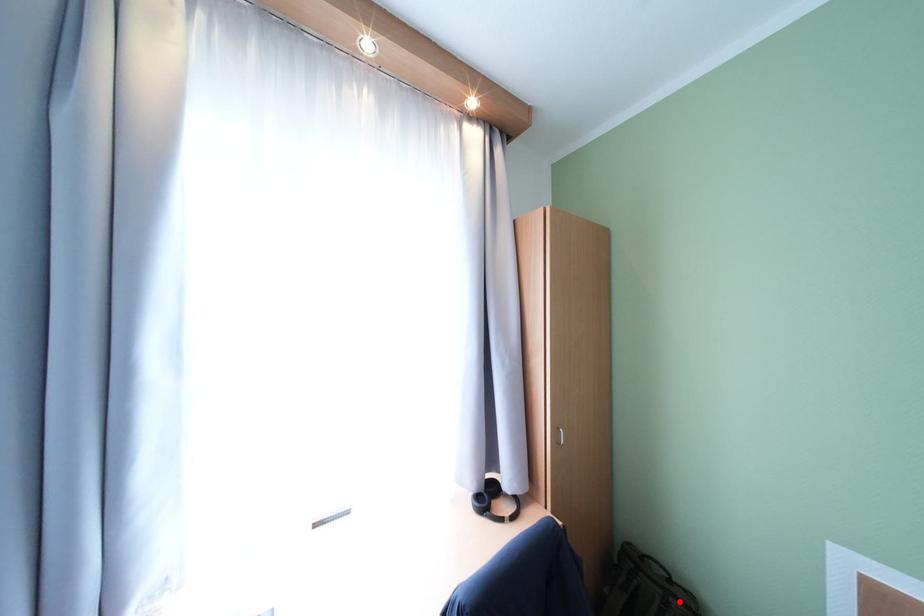
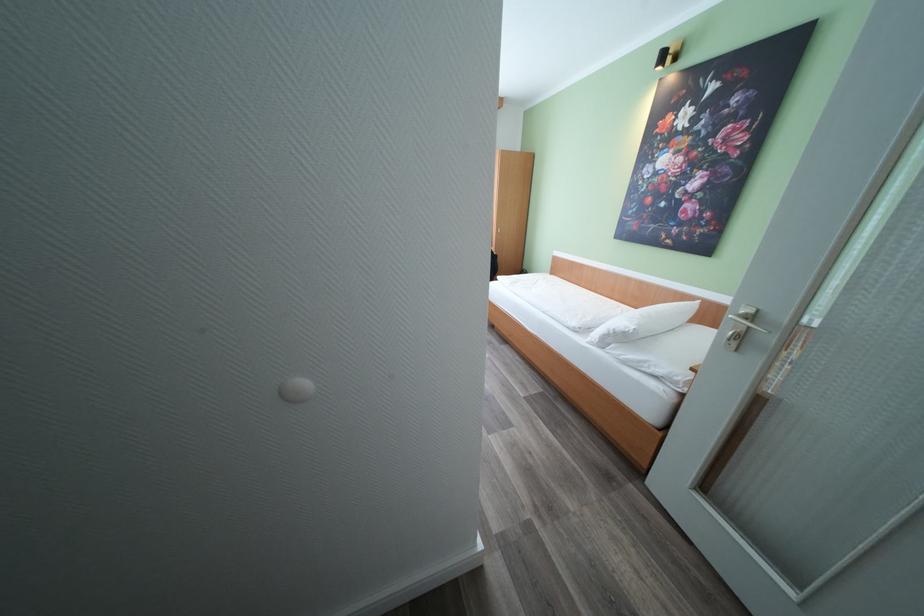
Question: I am providing you with two images of the same scene from different viewpoints. A red point is marked on the first image. Can you still see the location of the red point in image 2?

Choices:
 (A) Yes
 (B) No

Answer: (B)